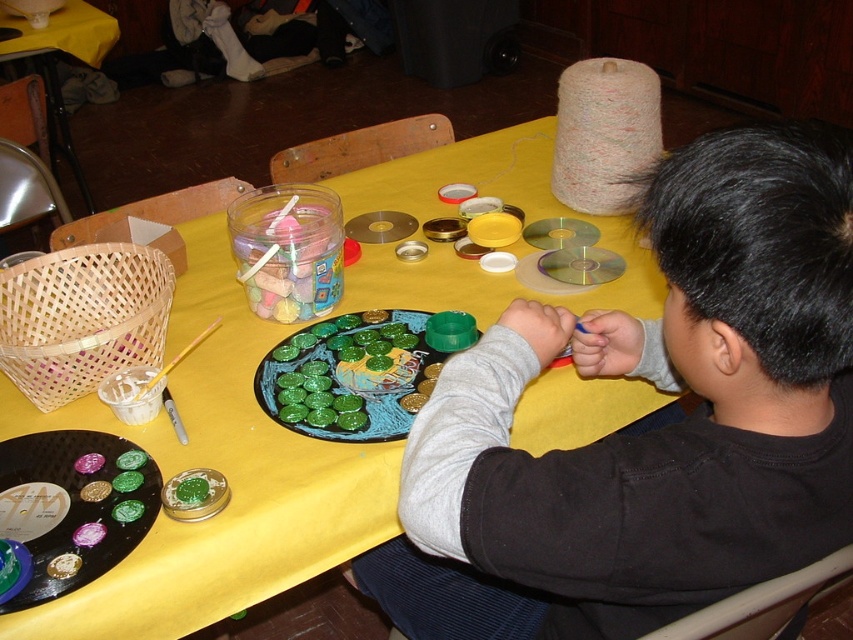
Between yellow fabric table at center and green glossy plate at center, which one is positioned lower?

green glossy plate at center is lower down.

Between yellow fabric table at center and green glossy plate at center, which one appears on the left side from the viewer's perspective?

green glossy plate at center is more to the left.

Image resolution: width=853 pixels, height=640 pixels. Identify the location of yellow fabric table at center. (225, 477).

Who is positioned more to the right, black matte shirt at upper right or green matte vinyl record at center?

black matte shirt at upper right is more to the right.

Which is in front, point (425, 442) or point (73, 458)?

Point (425, 442) is in front.

This screenshot has width=853, height=640. Find the location of `black matte shirt at upper right`. black matte shirt at upper right is located at coordinates (654, 429).

Which of these two, yellow fabric table at lower left or green matte paint at center, stands shorter?

Standing shorter between the two is green matte paint at center.

Is yellow fabric table at lower left positioned before green matte paint at center?

No.

Who is more forward, [74,35] or [71,564]?

Point [71,564]

Identify the location of yellow fabric table at lower left. The width and height of the screenshot is (853, 640). (59, 72).